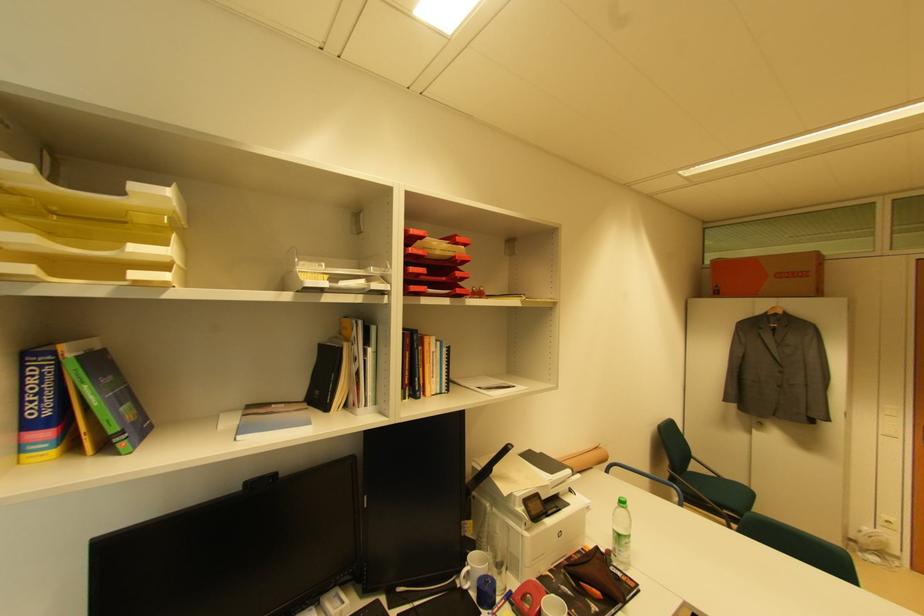
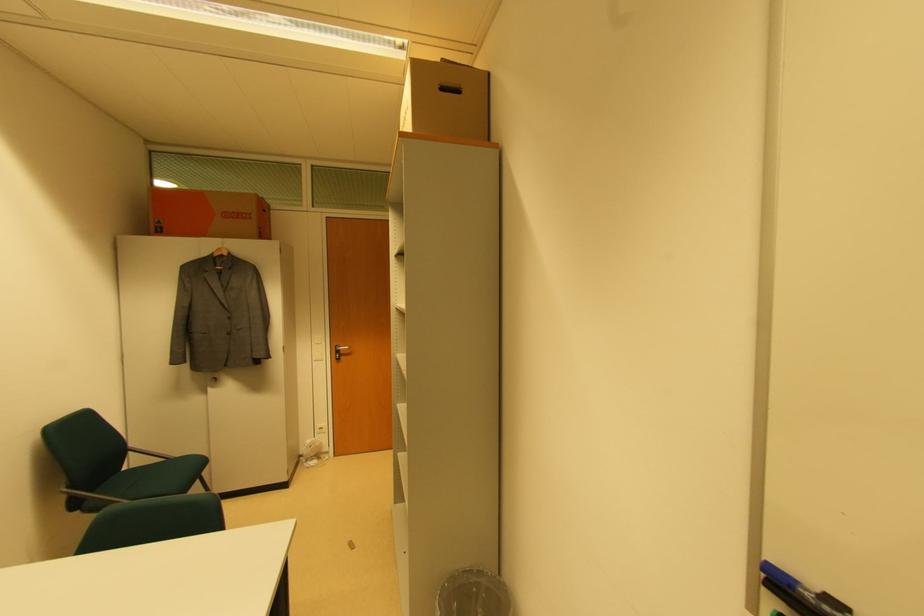
Question: Based on the continuous images, in which direction is the camera rotating? Reply with the corresponding letter.

Choices:
 (A) Left
 (B) Right
 (C) Up
 (D) Down

Answer: (B)